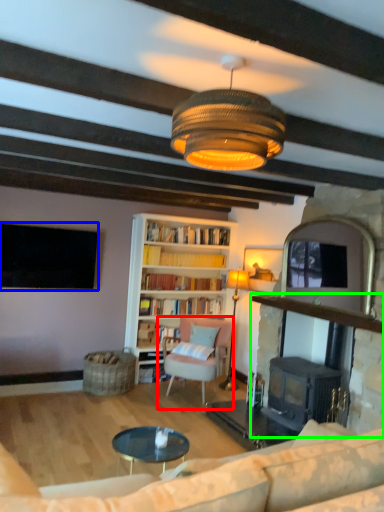
Question: Based on their relative distances, which object is nearer to chair (highlighted by a red box)? Choose from television (highlighted by a blue box) and fireplace (highlighted by a green box).

Choices:
 (A) television
 (B) fireplace

Answer: (B)